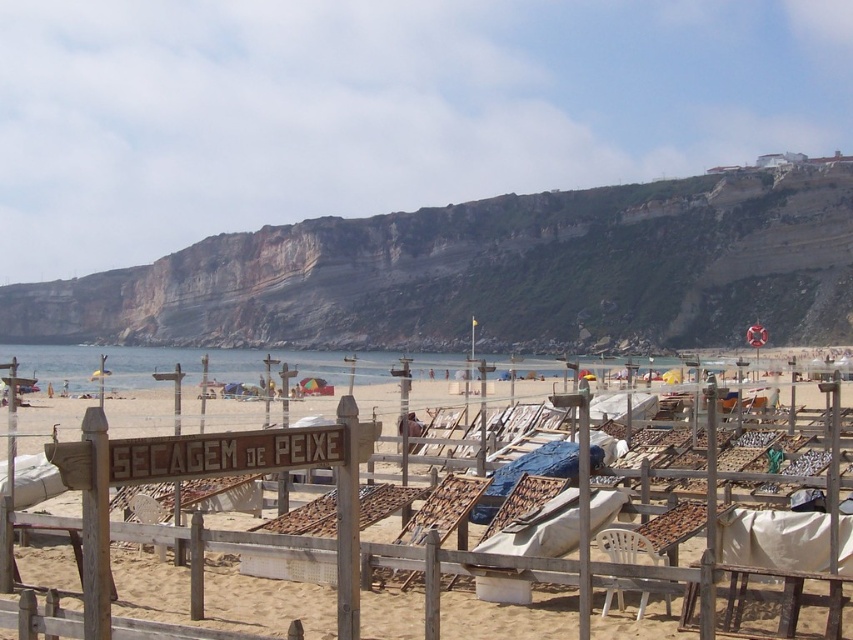
Question: Which object appears farthest from the camera in this image?

Choices:
 (A) white plastic chair at lower center
 (B) wooden lounge chairs at center

Answer: (A)

Question: Which point appears farthest from the camera in this image?

Choices:
 (A) (268, 541)
 (B) (709, 212)
 (C) (604, 545)

Answer: (B)

Question: Is wooden lounge chairs at center further to the viewer compared to white plastic chair at lower center?

Choices:
 (A) yes
 (B) no

Answer: (B)

Question: Which object appears closest to the camera in this image?

Choices:
 (A) wooden lounge chairs at center
 (B) rugged stone cliff at upper center

Answer: (A)

Question: Does wooden lounge chairs at center appear over white plastic chair at lower center?

Choices:
 (A) no
 (B) yes

Answer: (B)

Question: Can you confirm if rugged stone cliff at upper center is smaller than wooden lounge chairs at center?

Choices:
 (A) no
 (B) yes

Answer: (A)